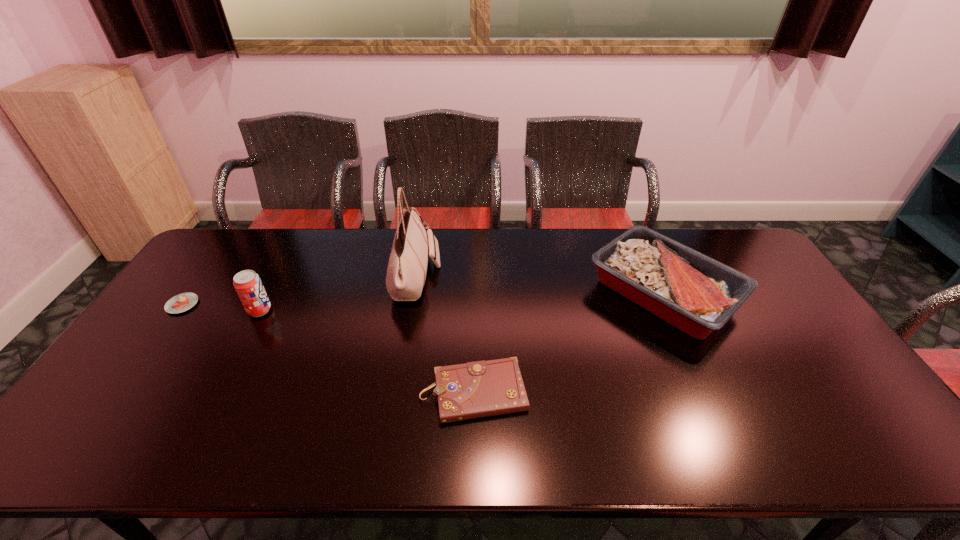
Locate an element on the screen. handbag is located at coordinates (406, 272).

This screenshot has width=960, height=540. What are the coordinates of `soda can` in the screenshot? It's located at (248, 285).

This screenshot has width=960, height=540. Find the location of `the rightmost object`. the rightmost object is located at coordinates (697, 294).

Find the location of a particular element. tray is located at coordinates (697, 294).

Find the location of a particular element. notebook is located at coordinates (477, 389).

This screenshot has height=540, width=960. What are the coordinates of `the fourth tallest object` in the screenshot? It's located at (477, 389).

Find the location of a particular element. This screenshot has width=960, height=540. pastry is located at coordinates (182, 302).

Where is `the leftmost object`? The height and width of the screenshot is (540, 960). the leftmost object is located at coordinates (182, 302).

Where is `free region located on the side of the handbag with the attached pouch`? The width and height of the screenshot is (960, 540). free region located on the side of the handbag with the attached pouch is located at coordinates (470, 277).

Find the location of a particular element. This screenshot has width=960, height=540. vacant area located on the back of the soda can is located at coordinates (280, 271).